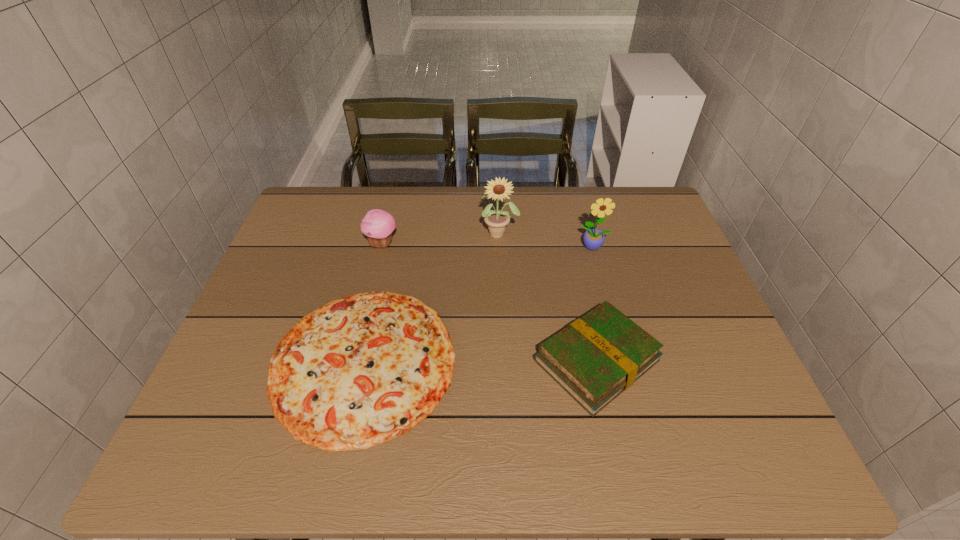
Find the location of a particular element. The image size is (960, 540). the tallest object is located at coordinates (496, 220).

I want to click on the left sunflower, so click(496, 220).

Where is `the shorter sunflower`? This screenshot has height=540, width=960. the shorter sunflower is located at coordinates (593, 239).

You are a GUI agent. You are given a task and a screenshot of the screen. Output one action in this format:
    pyautogui.click(x=<x>, y=<y>)
    Task: Click on the second tallest object
    Image resolution: width=960 pixels, height=540 pixels.
    Given the screenshot: What is the action you would take?
    pyautogui.click(x=593, y=239)

Image resolution: width=960 pixels, height=540 pixels. Find the location of `cupcake`. cupcake is located at coordinates (378, 225).

Locate an element on the screen. The image size is (960, 540). the fourth tallest object is located at coordinates (595, 358).

This screenshot has height=540, width=960. In order to click on the shortest object in this screenshot , I will do `click(362, 370)`.

What are the coordinates of `blank area located 0.310m on the front-facing side of the left sunflower` in the screenshot? It's located at (504, 327).

Find the location of `free space located on the front-facing side of the shorter sunflower`. free space located on the front-facing side of the shorter sunflower is located at coordinates (626, 362).

Locate an element on the screen. The height and width of the screenshot is (540, 960). free space located on the right of the cupcake is located at coordinates (497, 244).